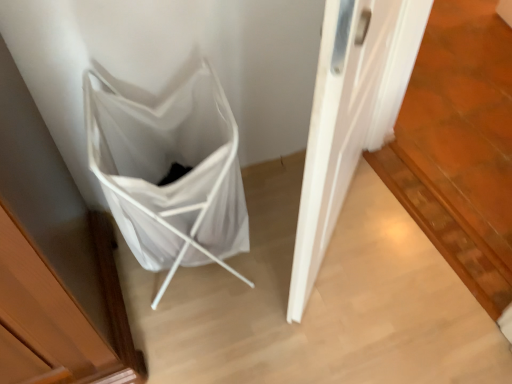
The image size is (512, 384). In order to click on vacant location below white matte door at center (from a real-world perspective) in this screenshot , I will do `click(339, 236)`.